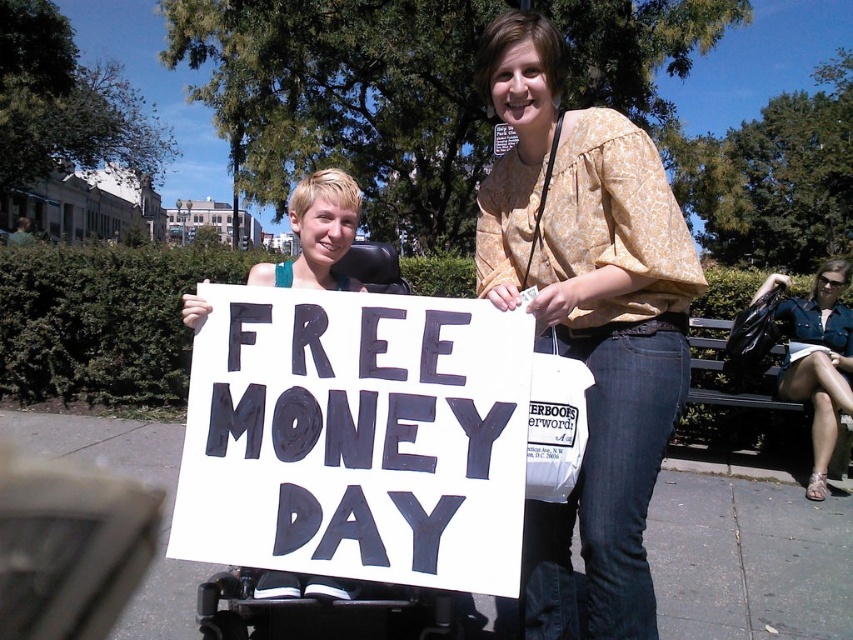
You are organizing a community event and need to decide which item to place in a promotional display. The display has a space that can only accommodate items smaller than the other. Which object from the scene should you choose, the white paper sign at center or the printed cotton blouse at center?

The white paper sign at center is smaller than the printed cotton blouse at center, so you should choose the white paper sign at center for the promotional display.

You are a photographer trying to capture a photo of both the printed cotton blouse at center and the dark brown wooden bench at right in the same frame. Based on their sizes, which object will appear larger in the photo?

The printed cotton blouse at center will appear larger in the photo because it has a greater height compared to the dark brown wooden bench at right.

You are a photographer trying to capture a closeup of the printed cotton blouse at center without including the dark brown wooden bench at right in the frame. Is this possible based on their positions?

The printed cotton blouse at center is positioned over the dark brown wooden bench at right, so the blouse is likely covering part of the bench. To avoid including the bench, the photographer should adjust the camera angle to focus solely on the blouse without the bench in view.